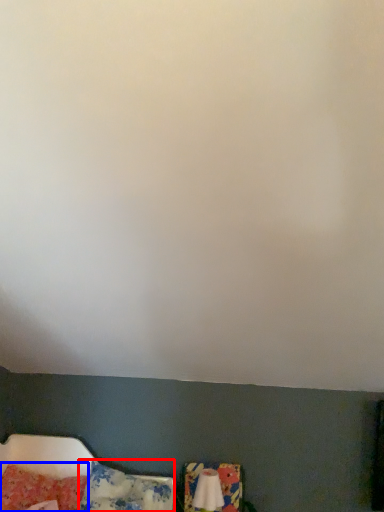
Question: Which point is further to the camera, pillow (highlighted by a red box) or pillow (highlighted by a blue box)?

Choices:
 (A) pillow
 (B) pillow

Answer: (B)